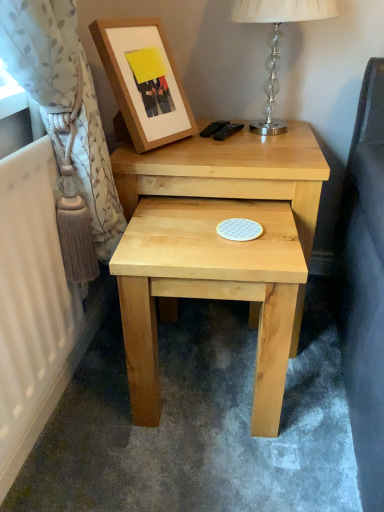
The image size is (384, 512). In order to click on empty space that is ontop of natural wood stool at center in this screenshot , I will do `click(210, 228)`.